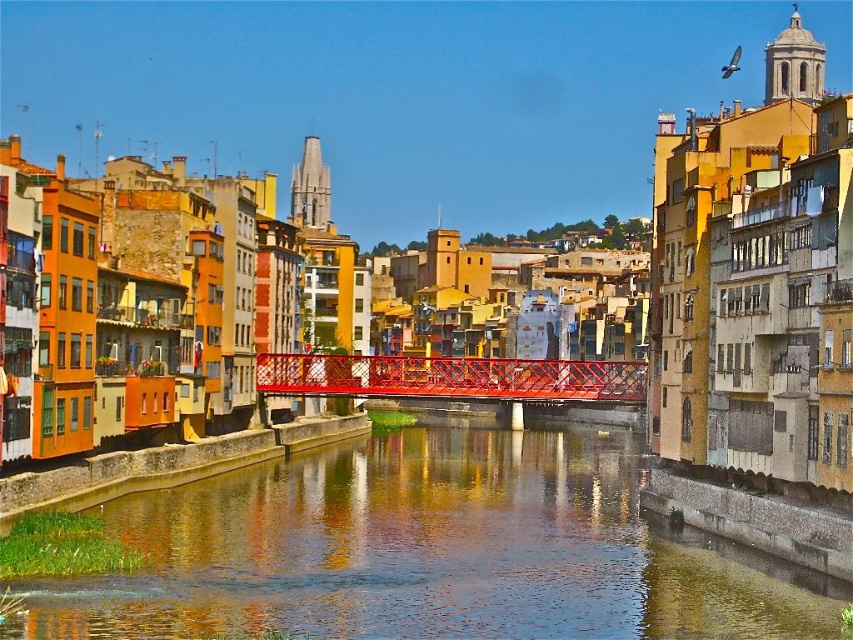
Question: Which point appears closest to the camera in this image?

Choices:
 (A) (355, 394)
 (B) (387, 483)

Answer: (B)

Question: Among these points, which one is farthest from the camera?

Choices:
 (A) (271, 369)
 (B) (277, 481)

Answer: (A)

Question: Is smooth concrete river at center to the right of metallic red bridge at center from the viewer's perspective?

Choices:
 (A) no
 (B) yes

Answer: (A)

Question: Observing the image, what is the correct spatial positioning of smooth concrete river at center in reference to metallic red bridge at center?

Choices:
 (A) right
 (B) left

Answer: (B)

Question: Is smooth concrete river at center positioned at the back of metallic red bridge at center?

Choices:
 (A) yes
 (B) no

Answer: (B)